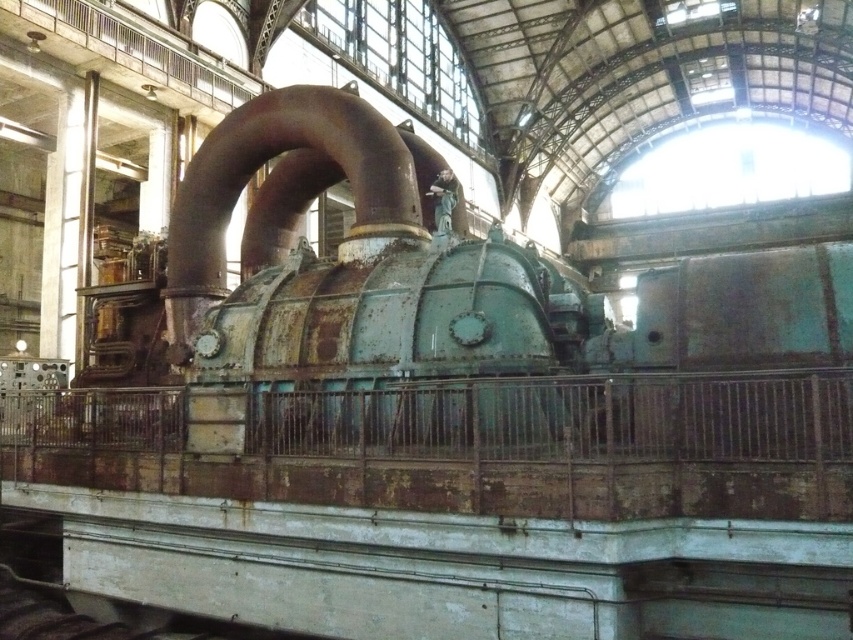
Which of these two, rusty metal steam engine at center or rusty metal pipe at center, stands shorter?

rusty metal pipe at center

Can you confirm if rusty metal steam engine at center is positioned below rusty metal pipe at center?

No.

Identify the location of rusty metal steam engine at center. The height and width of the screenshot is (640, 853). (351, 262).

Locate an element on the screen. rusty metal steam engine at center is located at coordinates [351, 262].